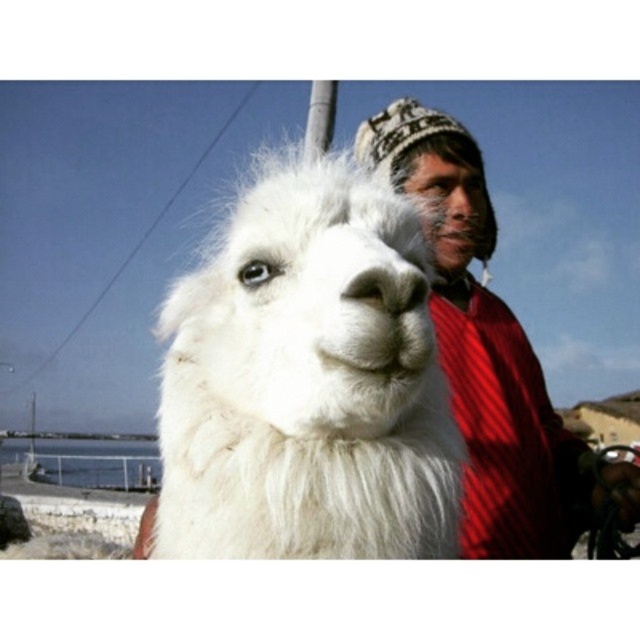
Question: Is white fluffy alpaca at center below knitted woolen hat at upper right?

Choices:
 (A) yes
 (B) no

Answer: (A)

Question: Which point appears farthest from the camera in this image?

Choices:
 (A) (486, 365)
 (B) (381, 365)

Answer: (A)

Question: Which of the following is the closest to the observer?

Choices:
 (A) knitted woolen hat at upper right
 (B) white fluffy alpaca at center

Answer: (B)

Question: Does white fluffy alpaca at center have a larger size compared to knitted woolen hat at upper right?

Choices:
 (A) no
 (B) yes

Answer: (A)

Question: Is white fluffy alpaca at center to the right of knitted woolen hat at upper right from the viewer's perspective?

Choices:
 (A) yes
 (B) no

Answer: (B)

Question: Which point is farther to the camera?

Choices:
 (A) white fluffy alpaca at center
 (B) knitted woolen hat at upper right

Answer: (B)